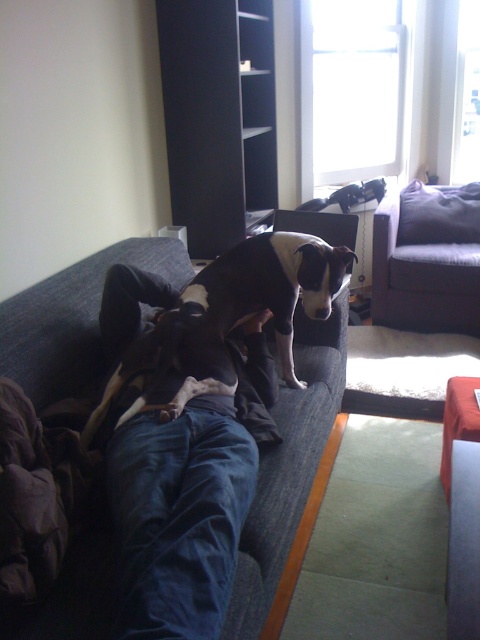
In the scene shown: You are a delivery robot that needs to place a package on the dark gray fabric couch at upper right. The robot is currently at the position of the black and white fur dog at center. Can you reach the couch without moving the dog?

The distance between the black and white fur dog at center and the dark gray fabric couch at upper right is 5.64 feet. Since the robot can move around the dog, it should be able to reach the couch without needing to move the dog itself.

From the picture: You are a photographer standing at a certain distance from the blue fabric couch at upper center. You want to take a photo of the couch such that it fills the frame perfectly. If your camera has a minimum focusing distance of 36 inches, will you need to move closer or farther away from the couch to achieve this?

The blue fabric couch at upper center is 37.22 inches from the camera. Since the minimum focusing distance is 36 inches, you need to move closer to the couch to ensure it fills the frame while staying within the camera range.